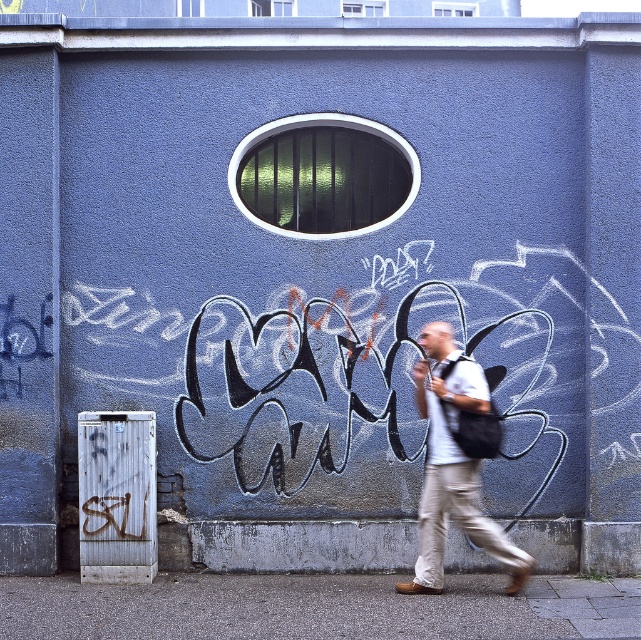
Is gray concrete pavement at lower center to the right of white cotton shirt at center from the viewer's perspective?

No, gray concrete pavement at lower center is not to the right of white cotton shirt at center.

Is gray concrete pavement at lower center behind white cotton shirt at center?

No, it is in front of white cotton shirt at center.

Is point (269, 636) farther from camera compared to point (472, 465)?

No, (269, 636) is closer to viewer.

Find the location of a particular element. The width and height of the screenshot is (641, 640). gray concrete pavement at lower center is located at coordinates (315, 608).